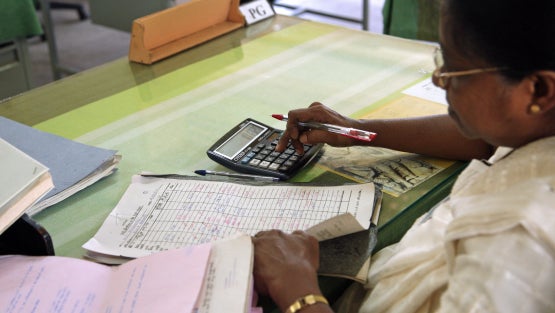
This screenshot has height=313, width=555. I want to click on display screen for numbers, so click(x=243, y=136).